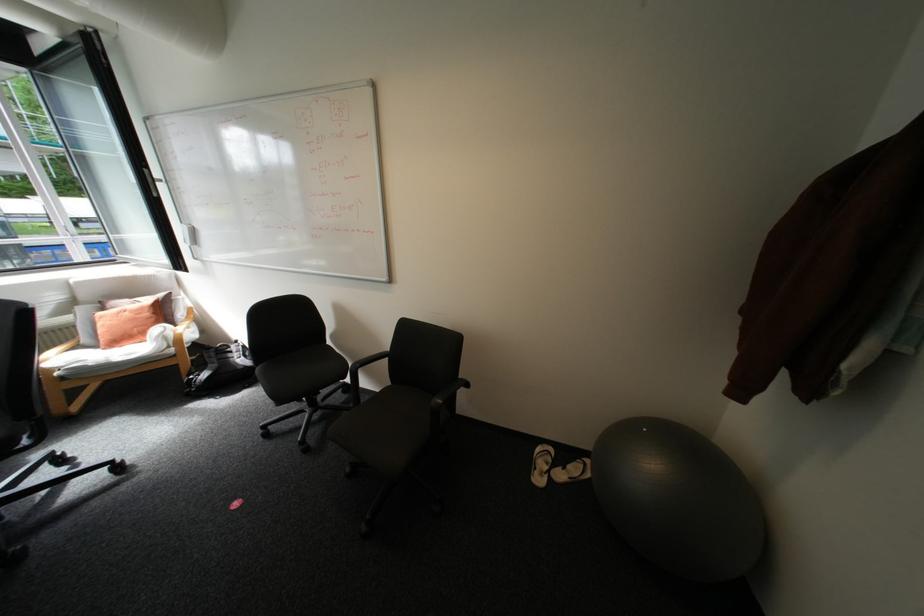
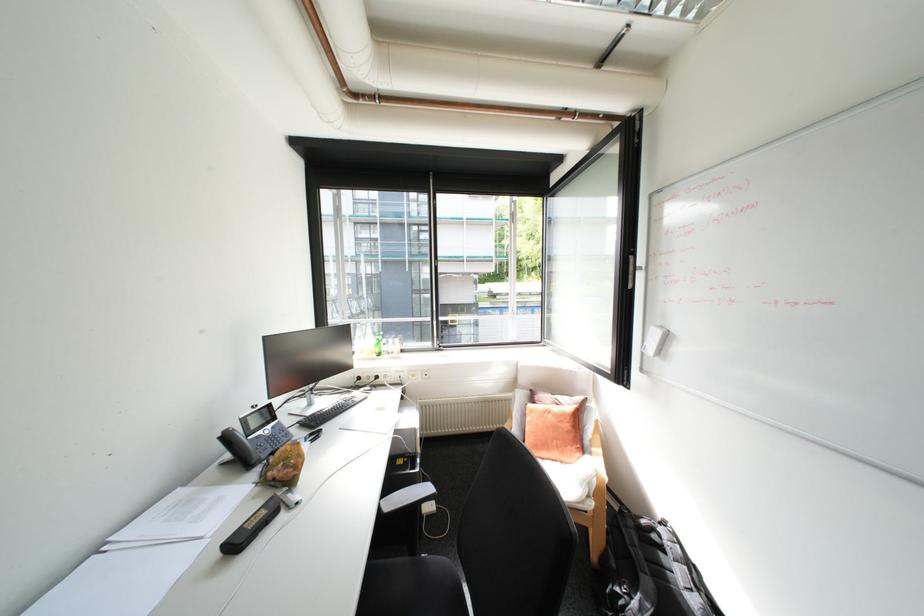
Question: I am providing you with two images of the same scene from different viewpoints. After the viewpoint changes to image2, which objects are now occluded?

Choices:
 (A) window handle
 (B) glass water bottle
 (C) chair sitting surface
 (D) none of these

Answer: (D)